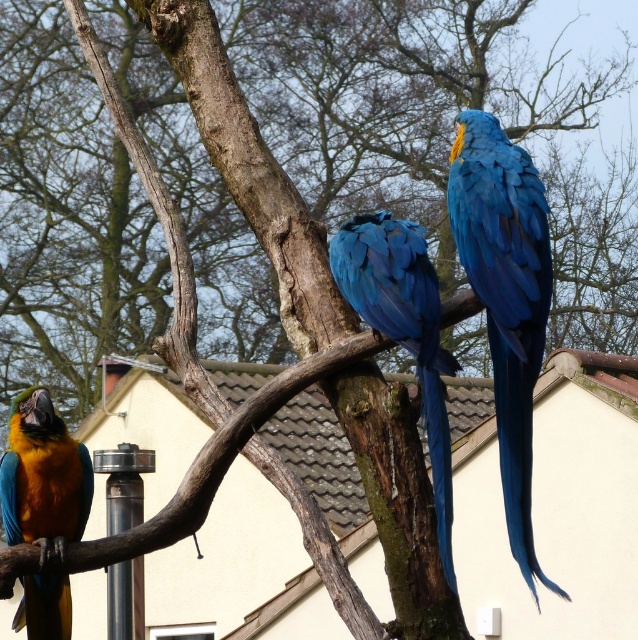
You are an ornithologist observing the macaws. You need to determine which parrot has a greater width between the blue glossy parrot at center and the matte blue parrot at left. Which one is wider?

The blue glossy parrot at center has a greater width than the matte blue parrot at left according to the description.

You are standing at a point 21 feet away from the point marked at coordinates (510, 528) in the image. If you want to move closer to that point, which direction should you walk relative to the tree branch where the macaws are perched?

The point marked at coordinates (510, 528) is 21.00 feet away from you. To move closer to it, you should walk towards the tree branch where the macaws are perched since the point is likely located near that area.

You are observing the scene and need to locate the blue glossy parrot at center. What are its coordinates according to the image grid?

The blue glossy parrot at center is located at point (x=403, y=330).